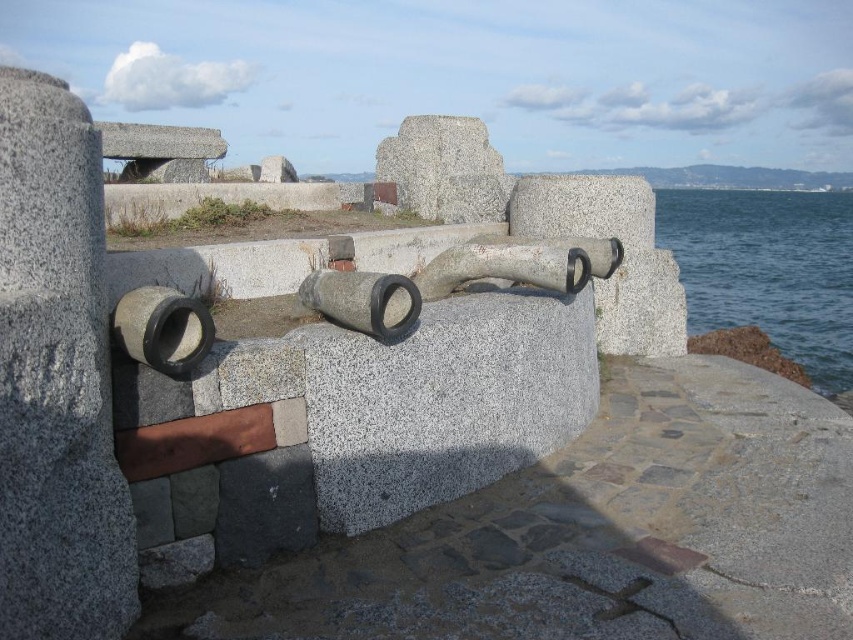
Does blue water at lower right have a greater width compared to gray stone cannon at center?

Yes, blue water at lower right is wider than gray stone cannon at center.

Is blue water at lower right taller than gray stone cannon at center?

Yes.

Where is `blue water at lower right`? Image resolution: width=853 pixels, height=640 pixels. blue water at lower right is located at coordinates (767, 269).

Locate an element on the screen. This screenshot has width=853, height=640. blue water at lower right is located at coordinates (767, 269).